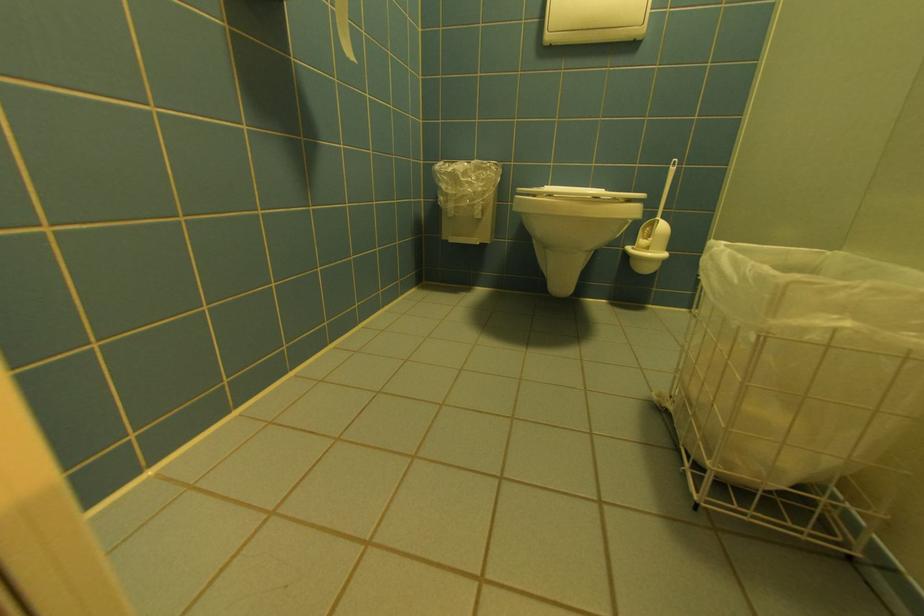
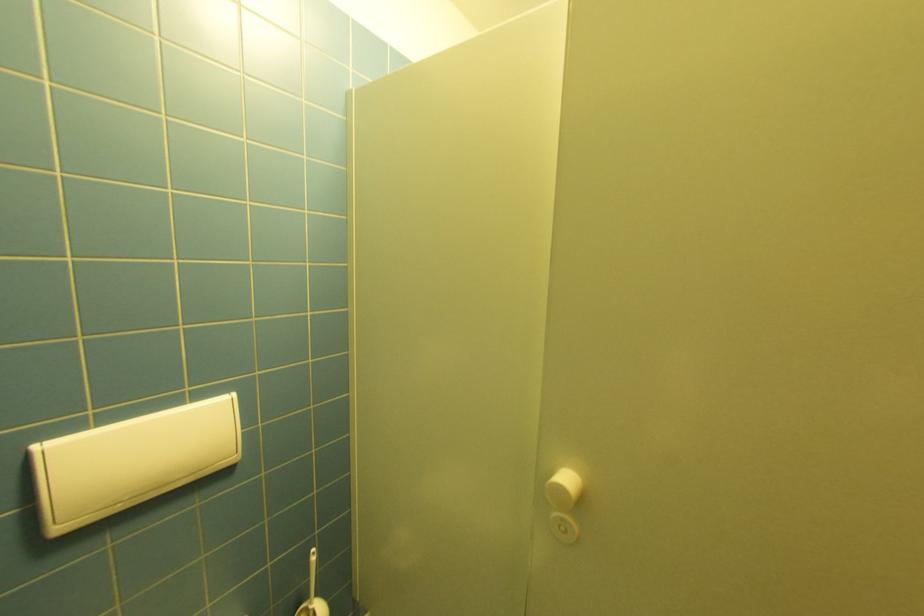
Where in the second image is the point corresponding to [554,38] from the first image?

(66, 530)